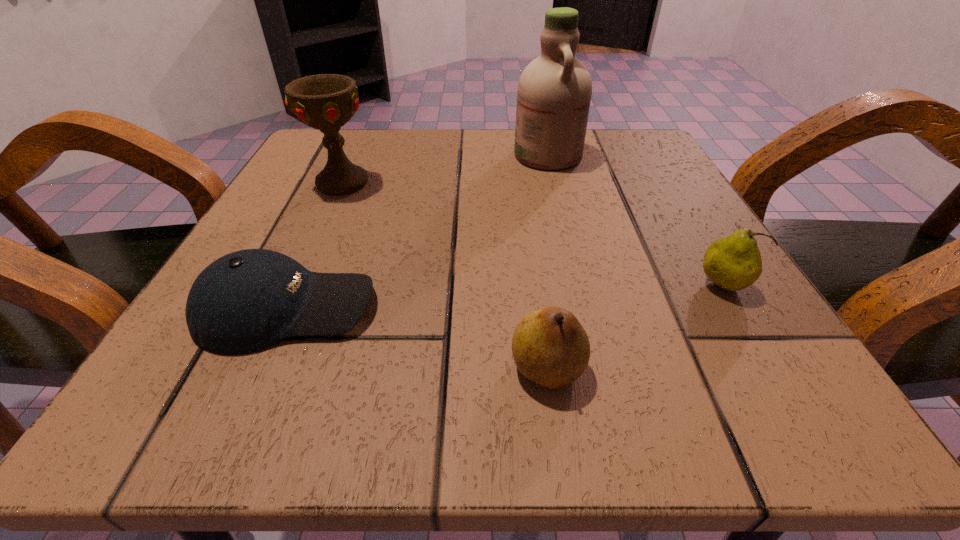
Where is `vacant area located 0.330m on the back of the nearer pear`? This screenshot has height=540, width=960. vacant area located 0.330m on the back of the nearer pear is located at coordinates (523, 195).

Where is `free space located on the back of the farther pear`? This screenshot has width=960, height=540. free space located on the back of the farther pear is located at coordinates [x=660, y=184].

The width and height of the screenshot is (960, 540). I want to click on vacant space positioned 0.310m on the front-facing side of the baseball cap, so click(612, 308).

Where is `cleansing agent located at the far edge`? The image size is (960, 540). cleansing agent located at the far edge is located at coordinates (554, 92).

In order to click on chalice located at the far edge in this screenshot , I will do `click(326, 102)`.

Image resolution: width=960 pixels, height=540 pixels. Identify the location of object present at the near edge. (550, 347).

Identify the location of chalice situated at the left edge. (326, 102).

The height and width of the screenshot is (540, 960). I want to click on baseball cap at the left edge, so click(245, 301).

You are a GUI agent. You are given a task and a screenshot of the screen. Output one action in this format:
    pyautogui.click(x=<x>, y=<y>)
    Task: Click on the cleansing agent present at the right edge
    The width and height of the screenshot is (960, 540).
    Given the screenshot: What is the action you would take?
    pyautogui.click(x=554, y=92)

This screenshot has height=540, width=960. In order to click on pear that is at the right edge in this screenshot , I will do `click(734, 262)`.